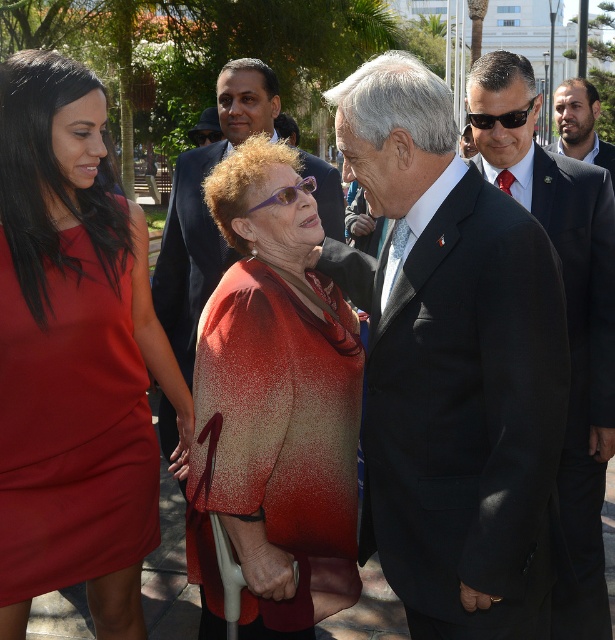
You are standing in the park and see two points marked in the image. Which point is closer to you, point (370, 534) or point (333, 600)?

Point (370, 534) is closer to you than point (333, 600) because it is further to the viewer.

You are standing at the point with coordinates point (566, 156) and want to walk to the point with coordinates point (295, 298). Which direction should you move in to reach your destination?

You should move forward since point (295, 298) is in front of point (566, 156).

In the scene shown: You are organizing a group photo and need to arrange two people based on their clothing width. You have a person wearing a speckled red coat at center and another in a matte black suit at upper right. Which clothing item is wider?

The speckled red coat at center is wider than the matte black suit at upper right according to the description.